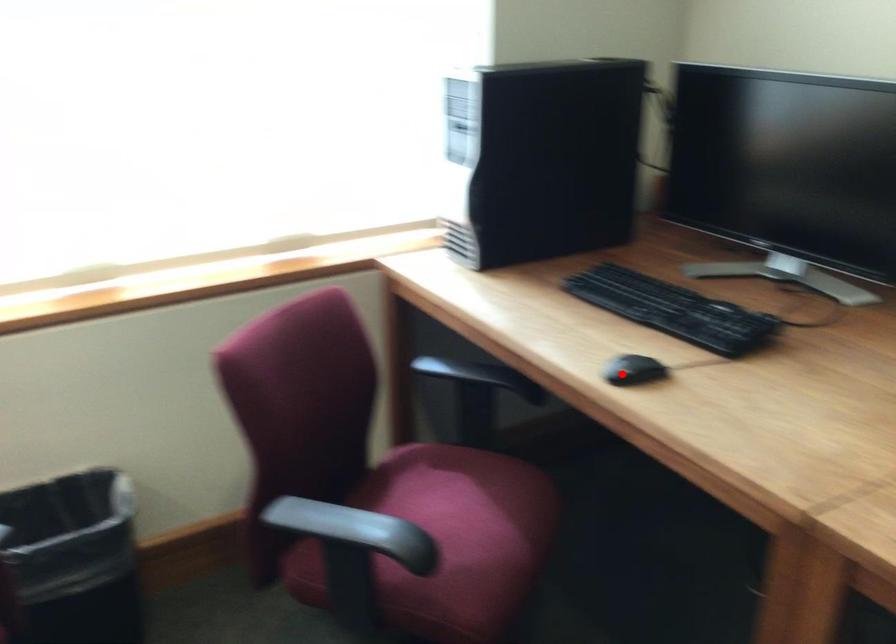
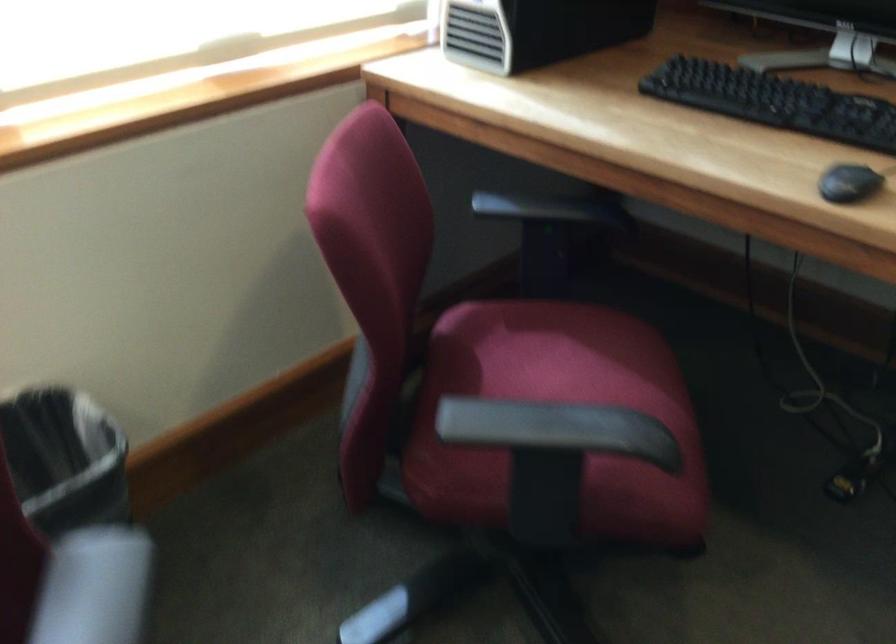
Question: I am providing you with two images of the same scene from different viewpoints. Given a red point in image1, look at the same physical point in image2. Is it:

Choices:
 (A) Closer to the viewpoint
 (B) Farther from the viewpoint

Answer: (A)